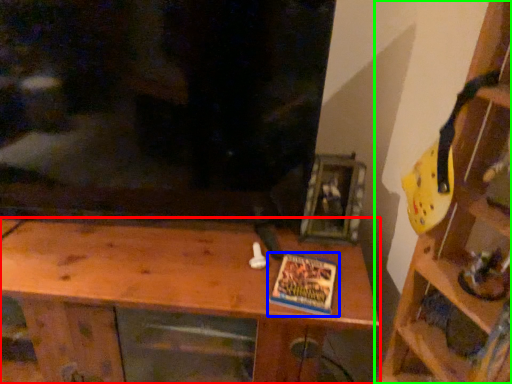
Question: Estimate the real-world distances between objects in this image. Which object is farther from shelf (highlighted by a red box), book (highlighted by a blue box) or shelf (highlighted by a green box)?

Choices:
 (A) book
 (B) shelf

Answer: (B)